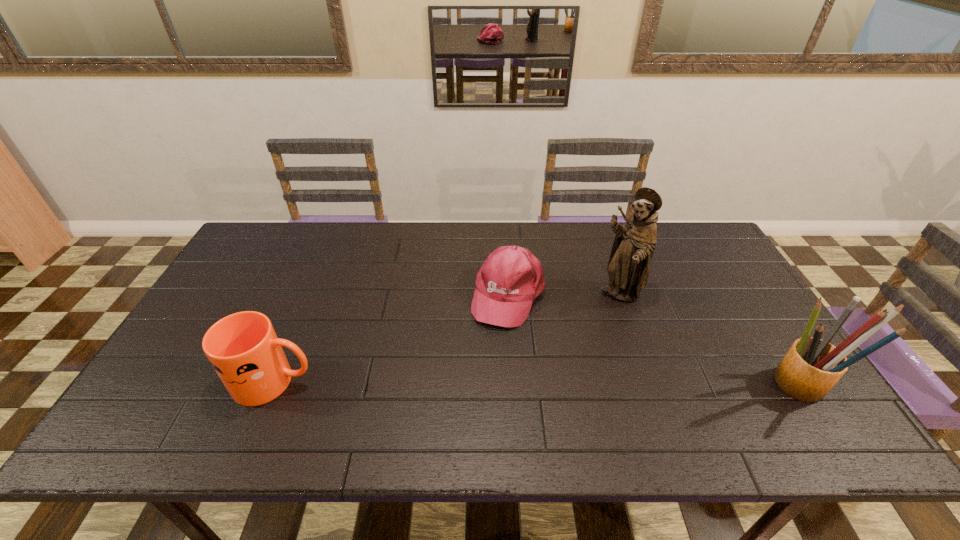
I want to click on object located at the near right corner, so click(812, 366).

Identify the location of vacant space at the far edge of the desktop. This screenshot has width=960, height=540. (480, 244).

In the image, there is a desktop. Identify the location of vacant space at the near edge. This screenshot has width=960, height=540. (681, 400).

You are a GUI agent. You are given a task and a screenshot of the screen. Output one action in this format:
    pyautogui.click(x=<x>, y=<y>)
    Task: Click on the vacant space at the left edge
    
    Given the screenshot: What is the action you would take?
    pyautogui.click(x=188, y=329)

Where is `vacant space at the right edge`? This screenshot has height=540, width=960. vacant space at the right edge is located at coordinates (x=743, y=317).

Image resolution: width=960 pixels, height=540 pixels. Find the location of `vacant space at the near left corner`. vacant space at the near left corner is located at coordinates (171, 406).

You are a GUI agent. You are given a task and a screenshot of the screen. Output one action in this format:
    pyautogui.click(x=<x>, y=<y>)
    Task: Click on the free space at the far right corner of the desktop
    
    Given the screenshot: What is the action you would take?
    pyautogui.click(x=665, y=242)

Where is `vacant space at the near right corner of the desktop`? Image resolution: width=960 pixels, height=540 pixels. vacant space at the near right corner of the desktop is located at coordinates (765, 392).

This screenshot has width=960, height=540. In order to click on free space between the pencil box and the baseball cap in this screenshot , I will do `click(653, 339)`.

Image resolution: width=960 pixels, height=540 pixels. I want to click on vacant area that lies between the tallest object and the rightmost object, so click(x=708, y=339).